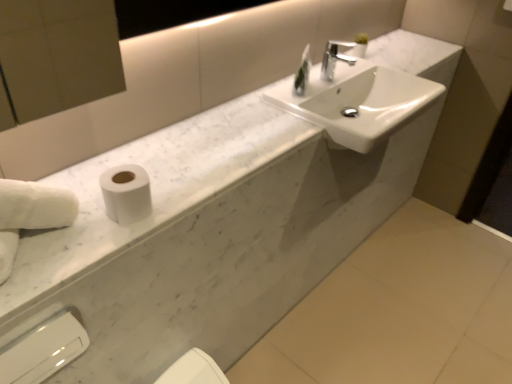
Find the location of a particular element. This screenshot has height=384, width=512. free space to the right of white matte toilet paper at left is located at coordinates [180, 198].